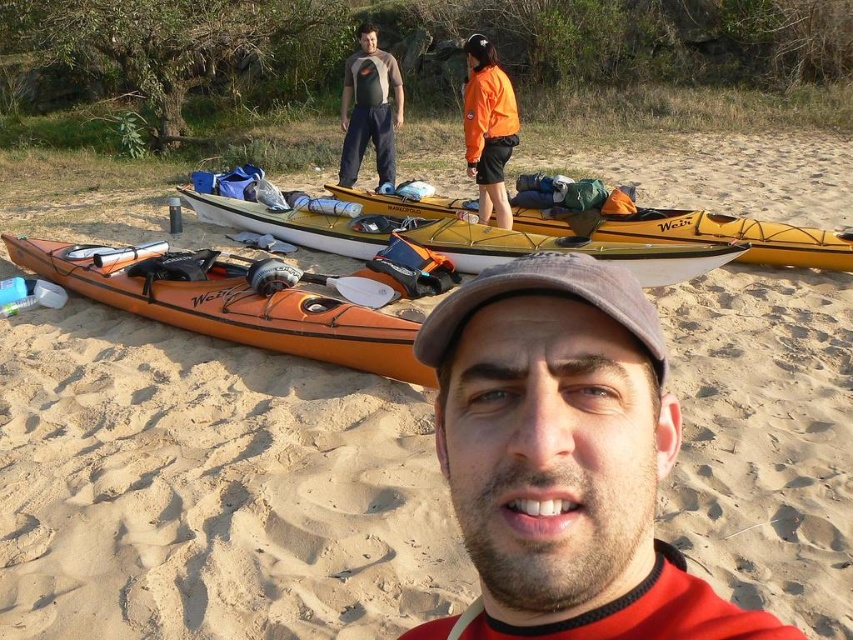
Looking at this image, you are a photographer trying to capture a photo of the yellow matte kayak at center and the orange fleece jacket at upper center. Which object should you focus on first to ensure both are in the frame?

The yellow matte kayak at center is in front of the orange fleece jacket at upper center, so you should focus on the yellow matte kayak at center first to ensure both are in the frame.